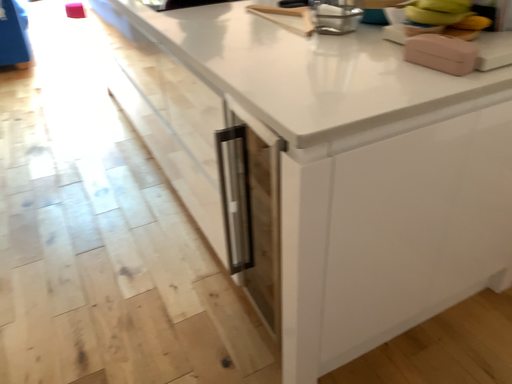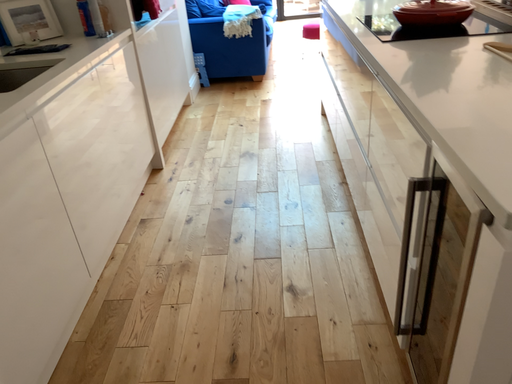
Question: Which way did the camera rotate in the video?

Choices:
 (A) rotated left
 (B) rotated right

Answer: (A)